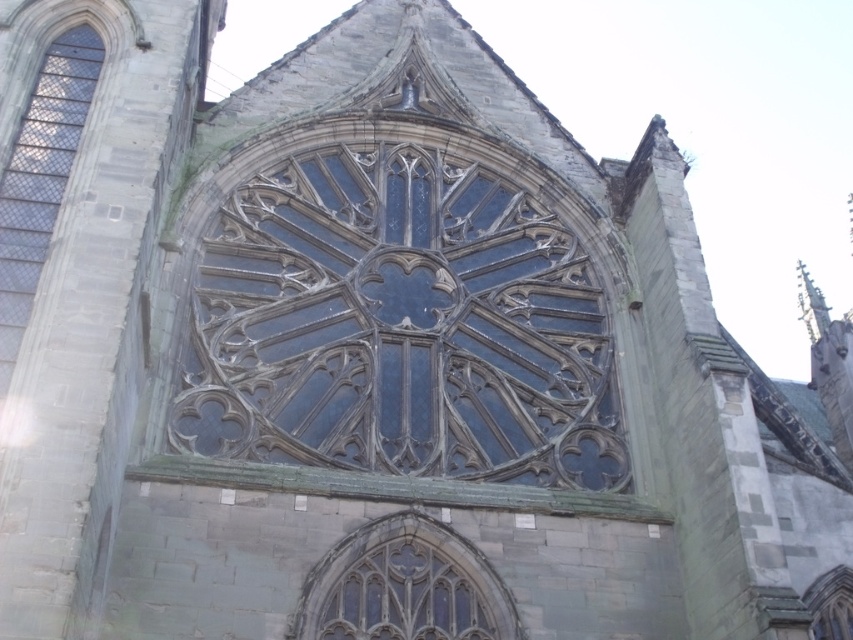
Is dark glass window at left taller than clear glass window at center?

Indeed, dark glass window at left has a greater height compared to clear glass window at center.

Is dark glass window at left smaller than clear glass window at center?

No, dark glass window at left is not smaller than clear glass window at center.

Does point (18, 250) lie in front of point (393, 588)?

Yes, it is.

Find the location of `dark glass window at left`. dark glass window at left is located at coordinates (39, 177).

Based on the photo, does dark glass window at center have a greater height compared to clear glass window at center?

Indeed, dark glass window at center has a greater height compared to clear glass window at center.

What do you see at coordinates (399, 326) in the screenshot? I see `dark glass window at center` at bounding box center [399, 326].

The height and width of the screenshot is (640, 853). I want to click on dark glass window at center, so click(x=399, y=326).

Between point (396, 339) and point (73, 124), which one is positioned in front?

Positioned in front is point (73, 124).

Which is more to the right, dark glass window at center or dark glass window at left?

Positioned to the right is dark glass window at center.

Describe the element at coordinates (399, 326) in the screenshot. I see `dark glass window at center` at that location.

Find the location of a particular element. The height and width of the screenshot is (640, 853). dark glass window at center is located at coordinates (399, 326).